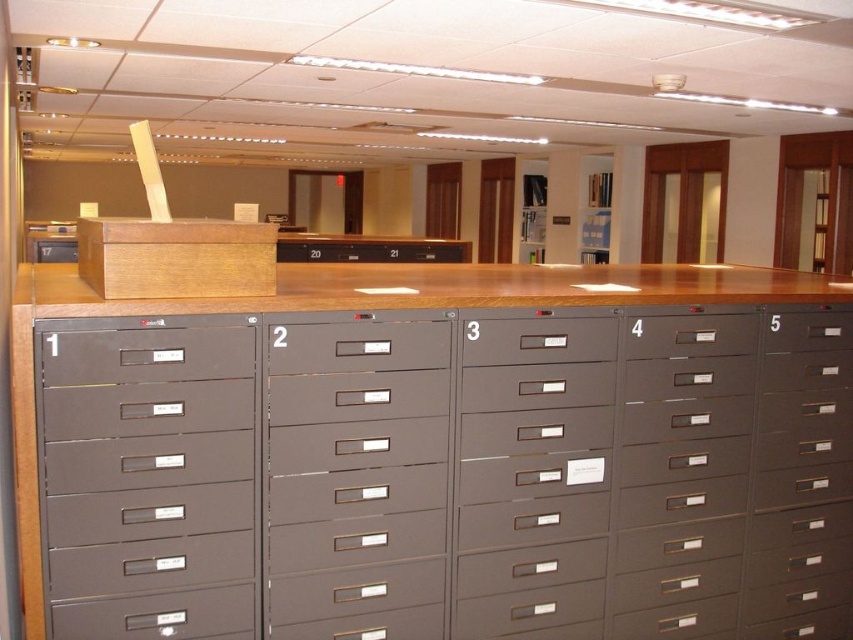
Question: Among these objects, which one is nearest to the camera?

Choices:
 (A) matte gray drawer at center
 (B) matte gray drawer at right
 (C) gray matte drawer at center
 (D) wooden at center

Answer: (D)

Question: Can you confirm if matte gray drawer at left is positioned below matte gray drawer at right?

Choices:
 (A) yes
 (B) no

Answer: (A)

Question: Is gray matte drawer at center further to camera compared to matte gray drawer at right?

Choices:
 (A) yes
 (B) no

Answer: (B)

Question: Which object is the closest to the matte gray drawer at right?

Choices:
 (A) brown wood table at center
 (B) matte gray drawer at left
 (C) gray matte drawer at center
 (D) matte gray drawer at center-right

Answer: (D)

Question: Considering the relative positions of matte gray drawer at lower left and matte gray drawer at center-right in the image provided, where is matte gray drawer at lower left located with respect to matte gray drawer at center-right?

Choices:
 (A) left
 (B) right

Answer: (A)

Question: Which of the following is the closest to the observer?

Choices:
 (A) [125, 374]
 (B) [567, 339]
 (C) [358, 362]
 (D) [838, 547]

Answer: (A)